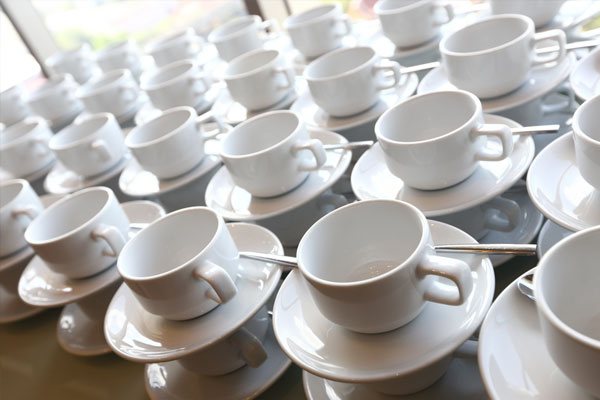
The height and width of the screenshot is (400, 600). I want to click on spoons, so click(272, 259), click(270, 312), click(496, 245), click(538, 126), click(352, 144), click(139, 224), click(577, 46), click(415, 67), click(523, 286).